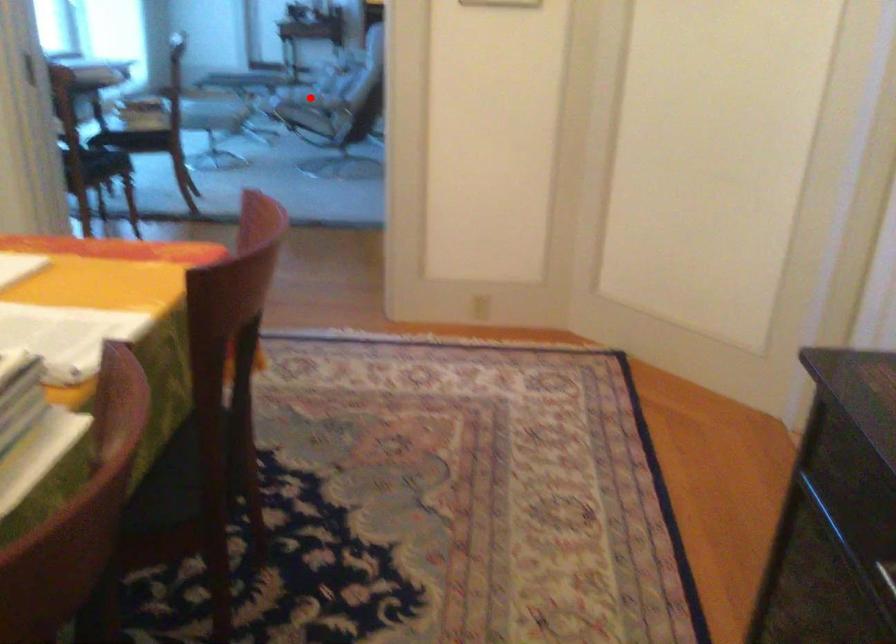
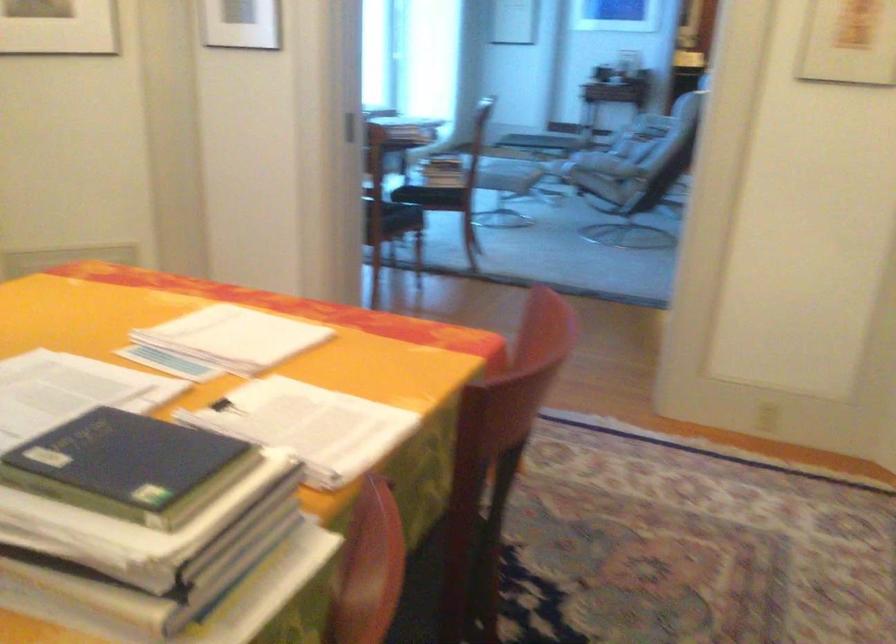
The point at the highlighted location is marked in the first image. Where is the corresponding point in the second image?

(604, 165)